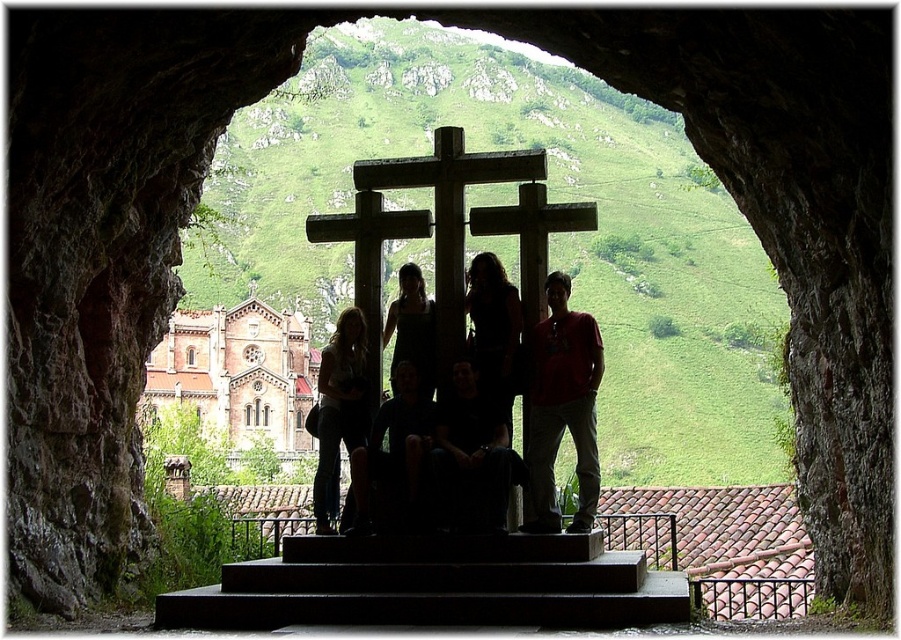
Question: Which object is the farthest from the dark fabric dress at center?

Choices:
 (A) red cotton shirt at center
 (B) black fabric at center
 (C) dark fabric pants at center

Answer: (C)

Question: Does red cotton shirt at center have a larger size compared to matte black dress at center?

Choices:
 (A) yes
 (B) no

Answer: (B)

Question: Among these objects, which one is nearest to the camera?

Choices:
 (A) black fabric at center
 (B) black dress at center

Answer: (A)

Question: Can you confirm if black fabric at center is wider than dark fabric dress at center?

Choices:
 (A) yes
 (B) no

Answer: (A)

Question: Is black fabric at center wider than matte black dress at center?

Choices:
 (A) no
 (B) yes

Answer: (A)

Question: Which object is closer to the camera taking this photo?

Choices:
 (A) red cotton shirt at center
 (B) black fabric at center
 (C) matte black dress at center

Answer: (B)